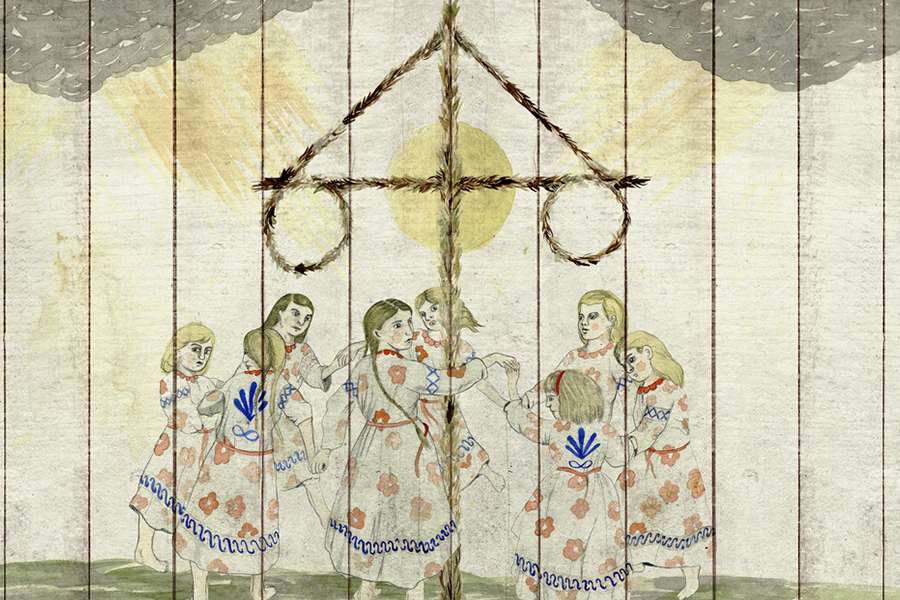
You are a GUI agent. You are given a task and a screenshot of the screen. Output one action in this format:
    pyautogui.click(x=<x>, y=<y>)
    Task: Click on the wood slats
    The width and height of the screenshot is (900, 600).
    Given the screenshot: What is the action you would take?
    pyautogui.click(x=49, y=139), pyautogui.click(x=128, y=154), pyautogui.click(x=231, y=148), pyautogui.click(x=295, y=139), pyautogui.click(x=393, y=141), pyautogui.click(x=496, y=150), pyautogui.click(x=597, y=120), pyautogui.click(x=670, y=141), pyautogui.click(x=762, y=156), pyautogui.click(x=850, y=171)